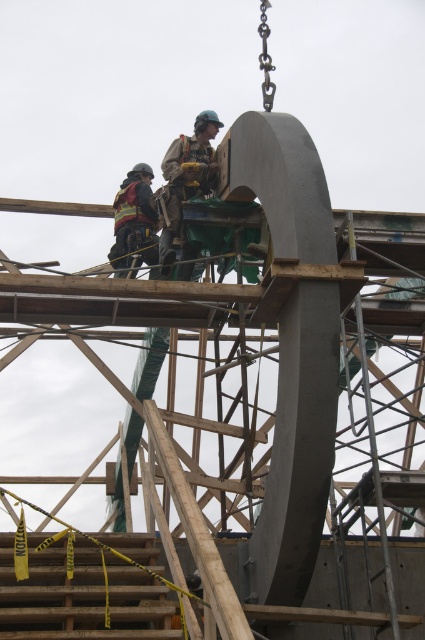
You are a safety inspector reviewing the image. You notice two safety vests, the camouflage fabric safety vest at center and the reflective safety vest at left. Which one is covering the other?

The camouflage fabric safety vest at center is positioned over the reflective safety vest at left, meaning it is covering the latter.

You are standing at the crane operator position and want to know which of the two points, point (187, 248) or point (133, 202), is closer to you. Based on the scene, can you determine which point is nearer?

Point (187, 248) is closer to the camera than point (133, 202), so the point (187, 248) is nearer to you.

You are a new worker at the construction site and need to locate your colleague wearing the camouflage fabric safety vest at center. According to the coordinates provided, where exactly should you look to find them?

The camouflage fabric safety vest at center is located at point (187, 177), so you should look at that coordinate to find your colleague.